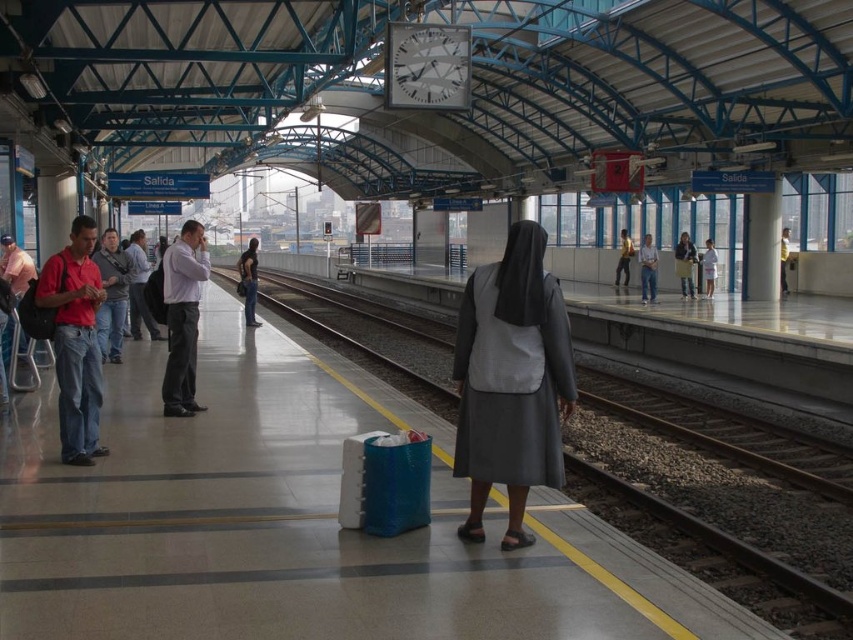
You are standing on the platform and want to walk to both the point at coordinates (527, 282) and the point at coordinates (248, 269). Which point should you reach first if you want to minimize your walking distance?

You should reach point (527, 282) first because it is closer to the viewer than point (248, 269), so it requires less walking distance.